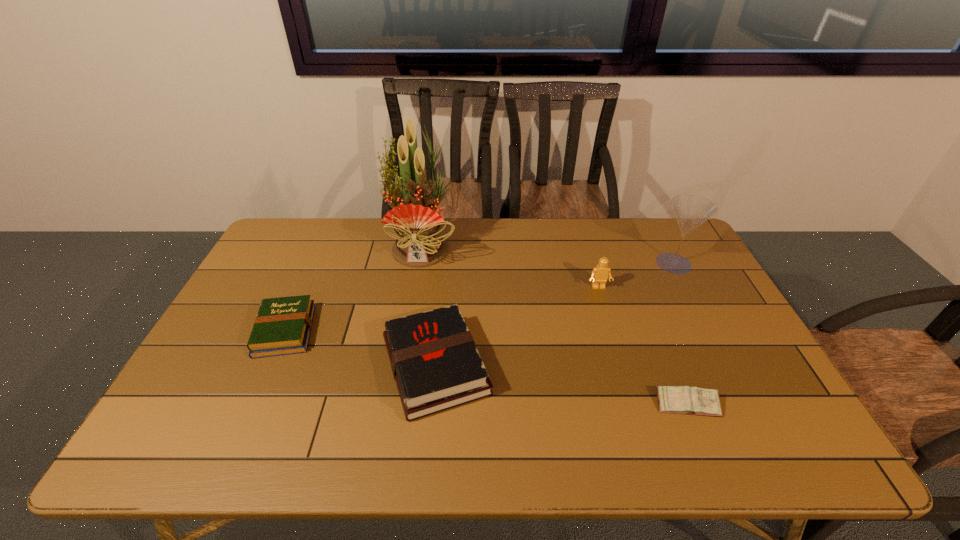
Identify the location of vacant area between the Lego and the flower arrangement. The width and height of the screenshot is (960, 540). (511, 267).

Where is `vacant area between the leftmost object and the fifth object from left to right`? The height and width of the screenshot is (540, 960). vacant area between the leftmost object and the fifth object from left to right is located at coordinates (486, 367).

This screenshot has width=960, height=540. Find the location of `free space between the fourth nearest object and the second tallest object`. free space between the fourth nearest object and the second tallest object is located at coordinates (636, 275).

The height and width of the screenshot is (540, 960). Find the location of `free space between the second object from right to left and the second tallest object`. free space between the second object from right to left and the second tallest object is located at coordinates (681, 334).

Identify the location of vacant region between the leftmost object and the tallest object. (354, 288).

Identify which object is located as the third nearest to the rightmost object. Please provide its 2D coordinates. Your answer should be formatted as a tuple, i.e. [(x, y)], where the tuple contains the x and y coordinates of a point satisfying the conditions above.

[(435, 363)]

The height and width of the screenshot is (540, 960). I want to click on object that is the fourth nearest to the rightmost object, so click(x=419, y=243).

The height and width of the screenshot is (540, 960). I want to click on free region that satisfies the following two spatial constraints: 1. on the face of the third farthest object; 2. on the left side of the fifth object from left to right, so click(634, 404).

You are a GUI agent. You are given a task and a screenshot of the screen. Output one action in this format:
    pyautogui.click(x=<x>, y=<y>)
    Task: Click on the blank area in the image that satisfies the following two spatial constraints: 1. in front of the tallest object with the fan visible; 2. on the right side of the flute glass
    The height and width of the screenshot is (540, 960).
    Given the screenshot: What is the action you would take?
    pyautogui.click(x=420, y=263)

Locate an element on the screen. Image resolution: width=960 pixels, height=540 pixels. vacant space that satisfies the following two spatial constraints: 1. on the face of the diary; 2. on the left side of the Lego is located at coordinates (634, 404).